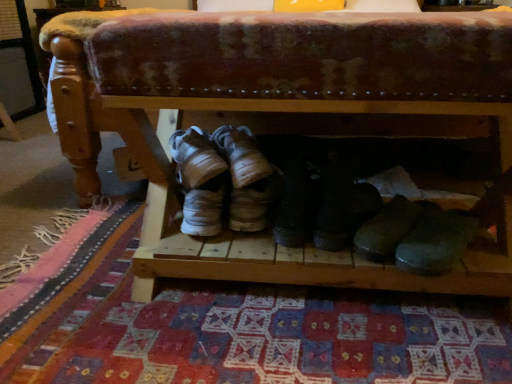
Question: Does black leather boots at center, the second footwear when ordered from right to left, appear on the right side of wooden shoe rack at center?

Choices:
 (A) no
 (B) yes

Answer: (A)

Question: Is black leather boots at center, the 2th footwear positioned from the left, far from wooden shoe rack at center?

Choices:
 (A) no
 (B) yes

Answer: (A)

Question: Is black leather boots at center, the second footwear when ordered from right to left, aimed at wooden shoe rack at center?

Choices:
 (A) no
 (B) yes

Answer: (B)

Question: From a real-world perspective, is black leather boots at center, the 2th footwear positioned from the left, under wooden shoe rack at center?

Choices:
 (A) yes
 (B) no

Answer: (A)

Question: Does black leather boots at center, the second footwear when ordered from right to left, have a smaller size compared to wooden shoe rack at center?

Choices:
 (A) no
 (B) yes

Answer: (B)

Question: Does black leather boots at center, the second footwear when ordered from right to left, have a lesser height compared to wooden shoe rack at center?

Choices:
 (A) yes
 (B) no

Answer: (A)

Question: Is black leather boot at center, arranged as the 3th footwear when viewed from the left, further to camera compared to white suede sneakers at center, which is counted as the 1th footwear, starting from the left?

Choices:
 (A) yes
 (B) no

Answer: (B)

Question: Can you confirm if black leather boot at center, marked as the 1th footwear in a right-to-left arrangement, is positioned to the right of white suede sneakers at center, positioned as the 3th footwear in right-to-left order?

Choices:
 (A) yes
 (B) no

Answer: (A)

Question: Does black leather boot at center, marked as the 1th footwear in a right-to-left arrangement, have a lesser height compared to white suede sneakers at center, which is counted as the 1th footwear, starting from the left?

Choices:
 (A) yes
 (B) no

Answer: (B)

Question: Is black leather boot at center, arranged as the 3th footwear when viewed from the left, beside white suede sneakers at center, which is counted as the 1th footwear, starting from the left?

Choices:
 (A) yes
 (B) no

Answer: (B)

Question: Can you confirm if black leather boot at center, marked as the 1th footwear in a right-to-left arrangement, is positioned to the left of white suede sneakers at center, which is counted as the 1th footwear, starting from the left?

Choices:
 (A) no
 (B) yes

Answer: (A)

Question: From the image's perspective, is black leather boot at center, arranged as the 3th footwear when viewed from the left, located above white suede sneakers at center, which is counted as the 1th footwear, starting from the left?

Choices:
 (A) yes
 (B) no

Answer: (B)

Question: Would you say wooden shoe rack at center contains white suede sneakers at center, positioned as the 3th footwear in right-to-left order?

Choices:
 (A) yes
 (B) no

Answer: (A)